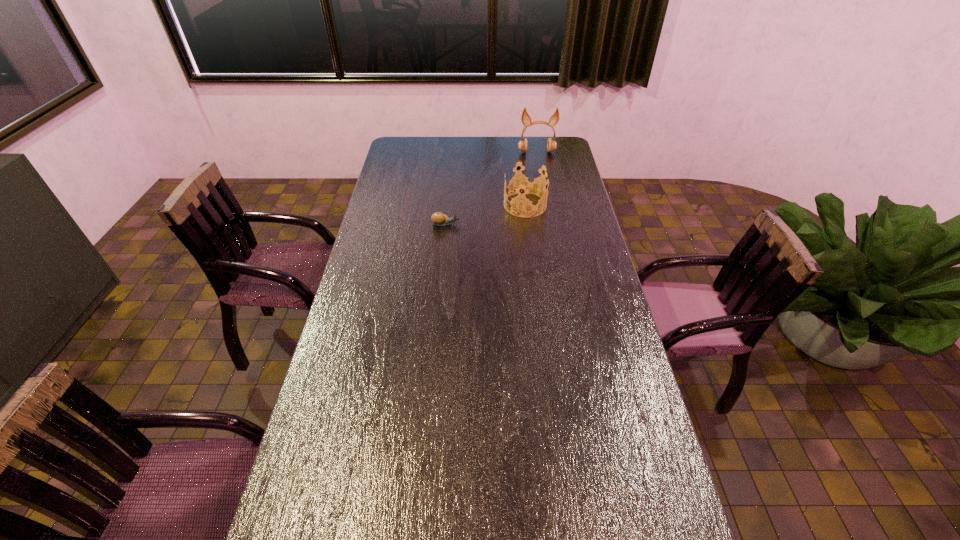
You are a GUI agent. You are given a task and a screenshot of the screen. Output one action in this format:
    pyautogui.click(x=<x>, y=<y>)
    Task: Click on the free spot between the nearest object and the second tallest object
    Image resolution: width=960 pixels, height=540 pixels.
    Given the screenshot: What is the action you would take?
    pyautogui.click(x=486, y=214)

You are a GUI agent. You are given a task and a screenshot of the screen. Output one action in this format:
    pyautogui.click(x=<x>, y=<y>)
    Task: Click on the free space that is in between the leftmost object and the farthest object
    This screenshot has height=540, width=960.
    Given the screenshot: What is the action you would take?
    pyautogui.click(x=492, y=188)

Point out which object is positioned as the nearest to the earphone. Please provide its 2D coordinates. Your answer should be formatted as a tuple, i.e. [(x, y)], where the tuple contains the x and y coordinates of a point satisfying the conditions above.

[(526, 185)]

At what (x,y) coordinates should I click in order to perform the action: click on object that can be found as the closest to the nearest object. Please return your answer as a coordinate pair (x, y). Image resolution: width=960 pixels, height=540 pixels. Looking at the image, I should click on (526, 185).

Image resolution: width=960 pixels, height=540 pixels. I want to click on free region that satisfies the following two spatial constraints: 1. on the front-facing side of the farthest object; 2. on the front-facing side of the shortest object, so click(x=550, y=224).

The width and height of the screenshot is (960, 540). Find the location of `free location that satisfies the following two spatial constraints: 1. on the front-facing side of the tallest object; 2. on the front-facing side of the nearest object`. free location that satisfies the following two spatial constraints: 1. on the front-facing side of the tallest object; 2. on the front-facing side of the nearest object is located at coordinates (550, 224).